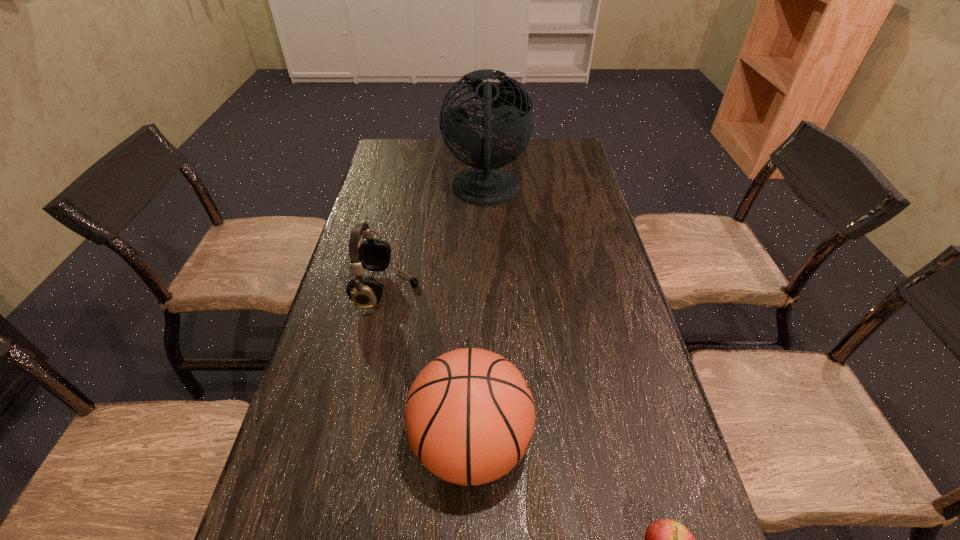
Locate an element on the screen. The image size is (960, 540). the farthest object is located at coordinates (486, 183).

Locate an element on the screen. The height and width of the screenshot is (540, 960). globe is located at coordinates (486, 183).

Locate an element on the screen. the third farthest object is located at coordinates (469, 416).

The height and width of the screenshot is (540, 960). I want to click on headset, so click(x=373, y=255).

What are the coordinates of `the second farthest object` in the screenshot? It's located at (373, 255).

The height and width of the screenshot is (540, 960). Find the location of `blank space located 0.170m on the front-facing side of the globe`. blank space located 0.170m on the front-facing side of the globe is located at coordinates (394, 191).

In order to click on free space located on the front-facing side of the globe in this screenshot , I will do `click(414, 191)`.

In order to click on free space located 0.050m on the front-facing side of the globe in this screenshot , I will do pos(429,191).

Where is `free region located on the surface of the third farthest object near the brand logo`? This screenshot has width=960, height=540. free region located on the surface of the third farthest object near the brand logo is located at coordinates (642, 444).

The image size is (960, 540). Find the location of `vacant area situated with the microphone on the side of the second farthest object`. vacant area situated with the microphone on the side of the second farthest object is located at coordinates (452, 290).